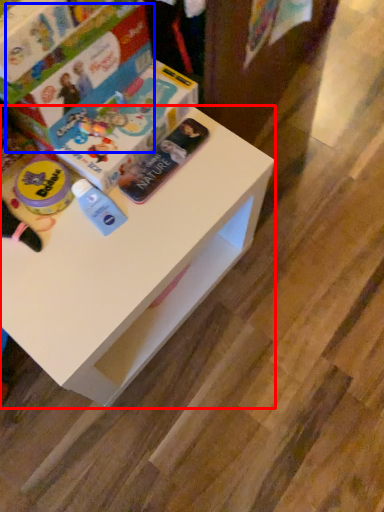
Question: Which of the following is the farthest to the observer, table (highlighted by a red box) or paperback book (highlighted by a blue box)?

Choices:
 (A) table
 (B) paperback book

Answer: (B)